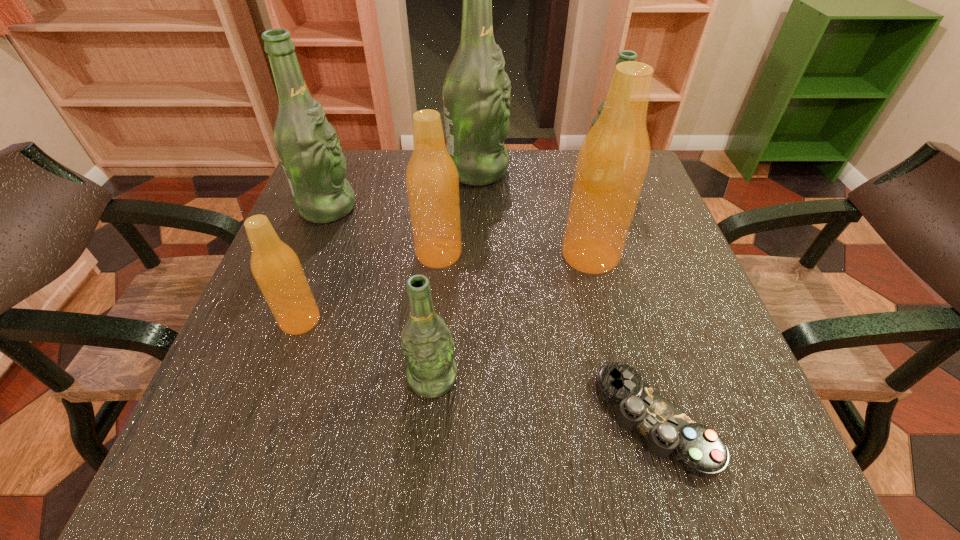
The height and width of the screenshot is (540, 960). In order to click on free space that satisfies the following two spatial constraints: 1. on the back side of the shortest object; 2. on the surface of the tallest object in this screenshot , I will do point(582,171).

Locate an element on the screen. The image size is (960, 540). free space in the image that satisfies the following two spatial constraints: 1. on the surface of the second smallest green beer bottle; 2. on the surface of the nearest beer bottle is located at coordinates (667, 378).

Where is `vacant region that satisfies the following two spatial constraints: 1. on the back side of the biggest tan beer bottle; 2. on the surface of the leftmost green beer bottle`? This screenshot has height=540, width=960. vacant region that satisfies the following two spatial constraints: 1. on the back side of the biggest tan beer bottle; 2. on the surface of the leftmost green beer bottle is located at coordinates (578, 208).

You are a GUI agent. You are given a task and a screenshot of the screen. Output one action in this format:
    pyautogui.click(x=<x>, y=<y>)
    Task: Click on the free space that satisfies the following two spatial constraints: 1. on the surface of the leftmost green beer bottle; 2. on the left side of the second nearest beer bottle
    
    Given the screenshot: What is the action you would take?
    pyautogui.click(x=283, y=320)

The width and height of the screenshot is (960, 540). I want to click on vacant space that satisfies the following two spatial constraints: 1. on the surface of the rightmost tan beer bottle; 2. on the right side of the leftmost green beer bottle, so click(309, 255).

The height and width of the screenshot is (540, 960). I want to click on vacant region that satisfies the following two spatial constraints: 1. on the surface of the second biggest green beer bottle; 2. on the right side of the leftmost tan beer bottle, so (x=283, y=320).